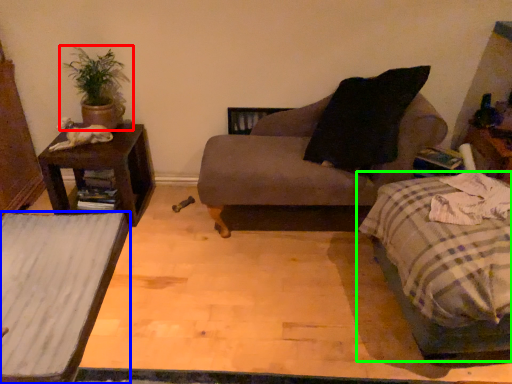
Question: Estimate the real-world distances between objects in this image. Which object is farther from houseplant (highlighted by a red box), table (highlighted by a blue box) or bed (highlighted by a green box)?

Choices:
 (A) table
 (B) bed

Answer: (B)